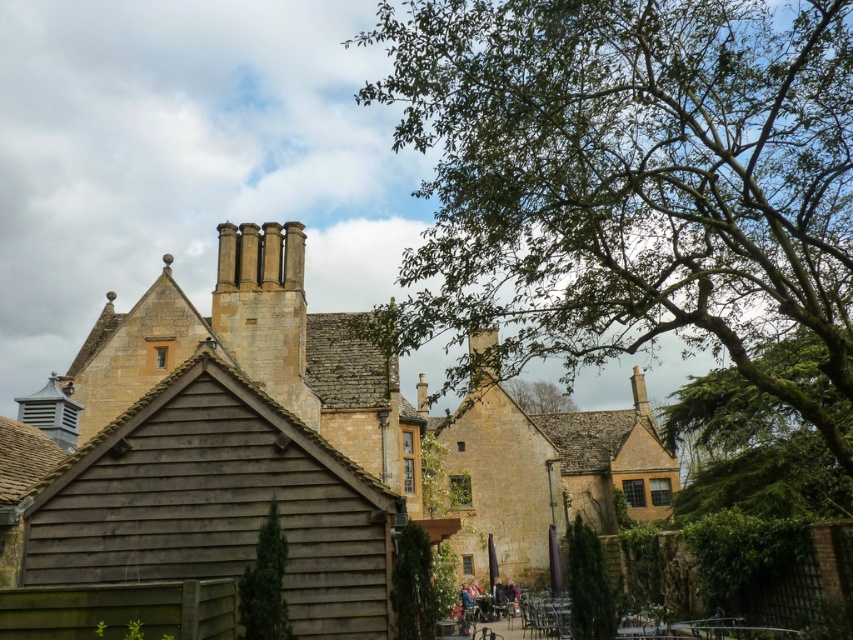
You are standing in front of the traditional stone building and notice two green trees in the scene. Which tree, the green leafy tree at upper center or the green textured tree at center, is closer to you?

The green leafy tree at upper center is closer to you because the green textured tree at center is positioned behind it.

You are standing in front of the traditional stone building and notice the green leafy tree at upper center and the green textured hedge at lower center. Which object is closer to you?

The green leafy tree at upper center is closer to you because it is in front of the green textured hedge at lower center.